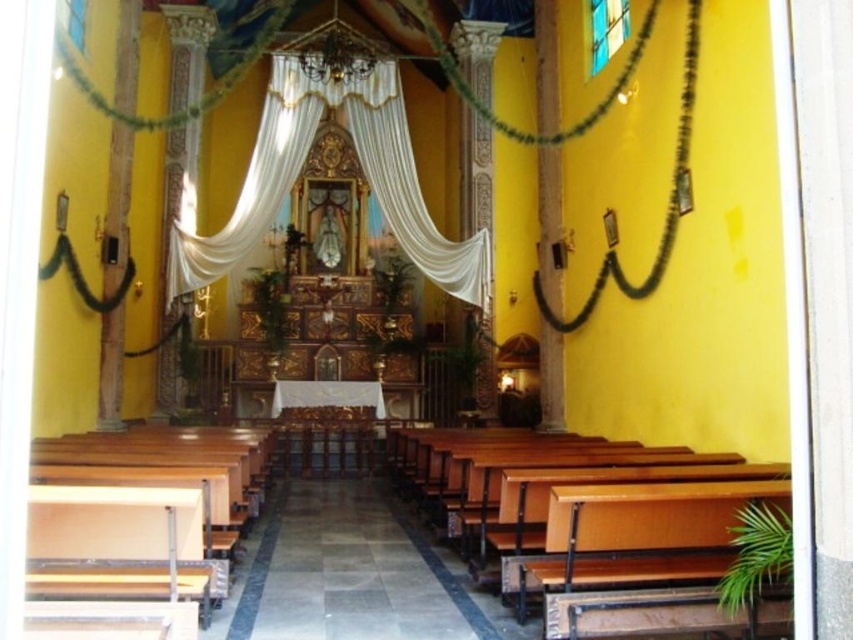
Question: Among these objects, which one is farthest from the camera?

Choices:
 (A) white sheer curtain at center
 (B) wooden church bench at center

Answer: (A)

Question: Is wooden church bench at center to the left of white sheer curtain at center from the viewer's perspective?

Choices:
 (A) yes
 (B) no

Answer: (B)

Question: Which object is farther from the camera taking this photo?

Choices:
 (A) wooden church bench at center
 (B) white sheer curtain at center

Answer: (B)

Question: Which object is farther from the camera taking this photo?

Choices:
 (A) white sheer curtain at center
 (B) wooden church bench at center

Answer: (A)

Question: Is wooden church bench at center to the right of white sheer curtain at center from the viewer's perspective?

Choices:
 (A) no
 (B) yes

Answer: (B)

Question: Does wooden church bench at center appear on the right side of white sheer curtain at center?

Choices:
 (A) no
 (B) yes

Answer: (B)